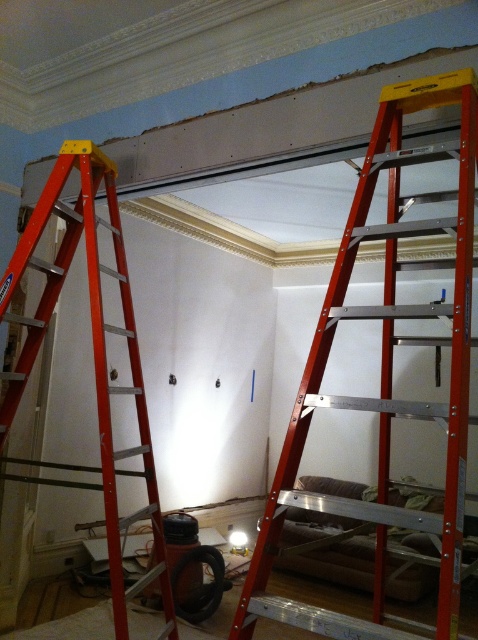
You are a construction worker standing at the entrance of the room. You need to move the metallic red ladder at center to the damaged wall area near the partially removed ceiling. Based on its current position, is the ladder closer to the entrance or the damaged wall area?

The ladder is at point (386, 372). Since the entrance is typically located at the edge of the room and the damaged wall area is near the partially removed ceiling, the ladder at center is closer to the damaged wall area.

You are a construction worker needing to reach a high point on the damaged wall near the partially removed ceiling. Which ladder should you choose between the metallic red ladder at center and the metallic orange ladder at left?

The metallic red ladder at center is larger than the metallic orange ladder at left, so you should choose the metallic red ladder at center to reach the high point safely.